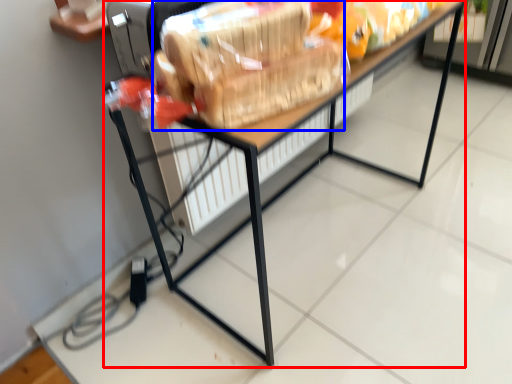
Question: Which object appears closest to the camera in this image, table (highlighted by a red box) or stuff (highlighted by a blue box)?

Choices:
 (A) table
 (B) stuff

Answer: (B)